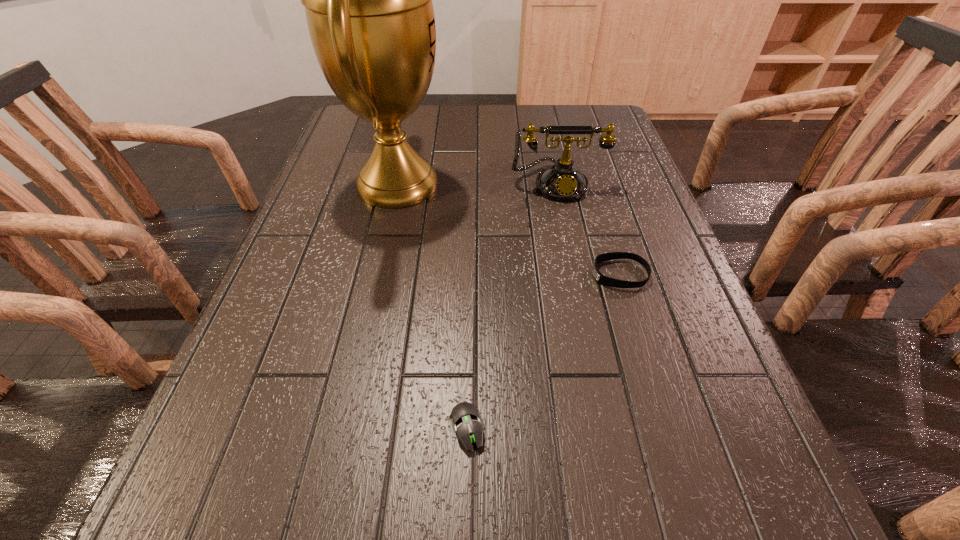
Find the location of a particular element. free space at the left edge of the desktop is located at coordinates (268, 418).

The height and width of the screenshot is (540, 960). I want to click on vacant space at the right edge of the desktop, so click(x=636, y=171).

Locate an element on the screen. vacant space at the far right corner of the desktop is located at coordinates (591, 112).

Find the location of a particular element. This screenshot has width=960, height=540. vacant space in between the telephone and the leftmost object is located at coordinates (477, 184).

The width and height of the screenshot is (960, 540). I want to click on vacant area between the third shortest object and the tallest object, so click(477, 184).

Find the location of `free point between the second shortest object and the trophy cup`. free point between the second shortest object and the trophy cup is located at coordinates (509, 229).

This screenshot has width=960, height=540. Find the location of `free spot between the nearest object and the second tallest object`. free spot between the nearest object and the second tallest object is located at coordinates (512, 306).

I want to click on free point between the third shortest object and the wristband, so click(x=588, y=228).

Where is `vacant region between the trophy cup and the second shortest object`? The image size is (960, 540). vacant region between the trophy cup and the second shortest object is located at coordinates (509, 229).

Find the location of `free spot between the tallest object and the third tallest object`. free spot between the tallest object and the third tallest object is located at coordinates (509, 229).